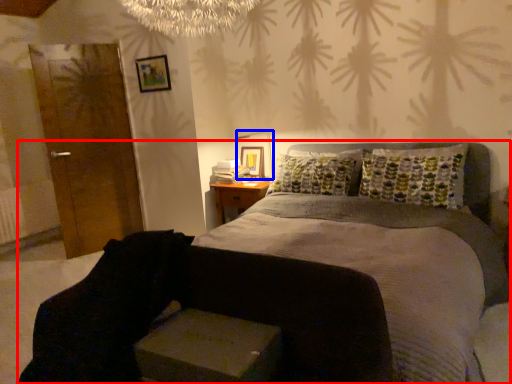
Question: Among these objects, which one is farthest to the camera, bed (highlighted by a red box) or table lamp (highlighted by a blue box)?

Choices:
 (A) bed
 (B) table lamp

Answer: (B)